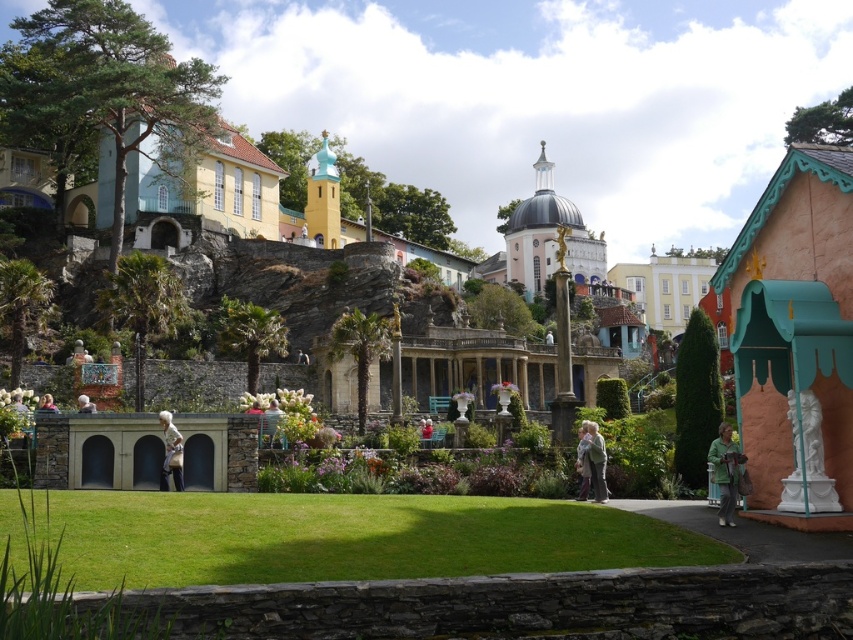
You are a character in a fantasy story exploring this magical garden. You spot both the green textured coat at center and the light brown leather jacket at center. Which one is positioned lower in the scene?

The green textured coat at center is located below the light brown leather jacket at center, so it is positioned lower in the scene.